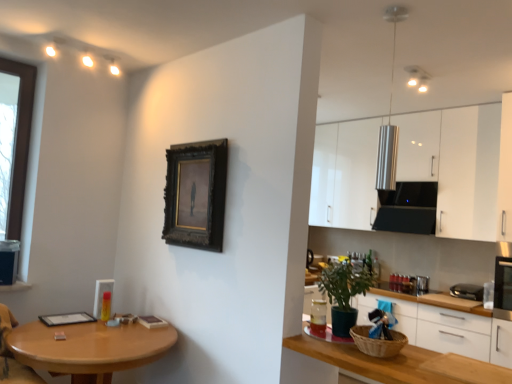
Question: From the image's perspective, is white glossy cabinets at right, which is the first cabinetry in bottom-to-top order, positioned above or below green matte plant at lower right?

Choices:
 (A) above
 (B) below

Answer: (B)

Question: Looking at the image, does white glossy cabinets at right, which appears as the 2th cabinetry when viewed from the top, seem bigger or smaller compared to green matte plant at lower right?

Choices:
 (A) small
 (B) big

Answer: (B)

Question: Estimate the real-world distances between objects in this image. Which object is farther from the wooden table at lower left?

Choices:
 (A) white glossy cabinets at right, which appears as the 2th cabinetry when viewed from the top
 (B) green matte plant at lower right
 (C) white glossy cabinets at upper right, positioned as the second cabinetry in bottom-to-top order
 (D) white glossy drawer at lower right
 (E) black plastic toaster at right

Answer: (E)

Question: Which object is the farthest from the black plastic toaster at right?

Choices:
 (A) white glossy cabinets at right, which is the first cabinetry in bottom-to-top order
 (B) dark wood picture frame at center
 (C) white glossy cabinets at upper right, the first cabinetry in the top-to-bottom sequence
 (D) green matte plant at lower right
 (E) white glossy drawer at lower right

Answer: (B)